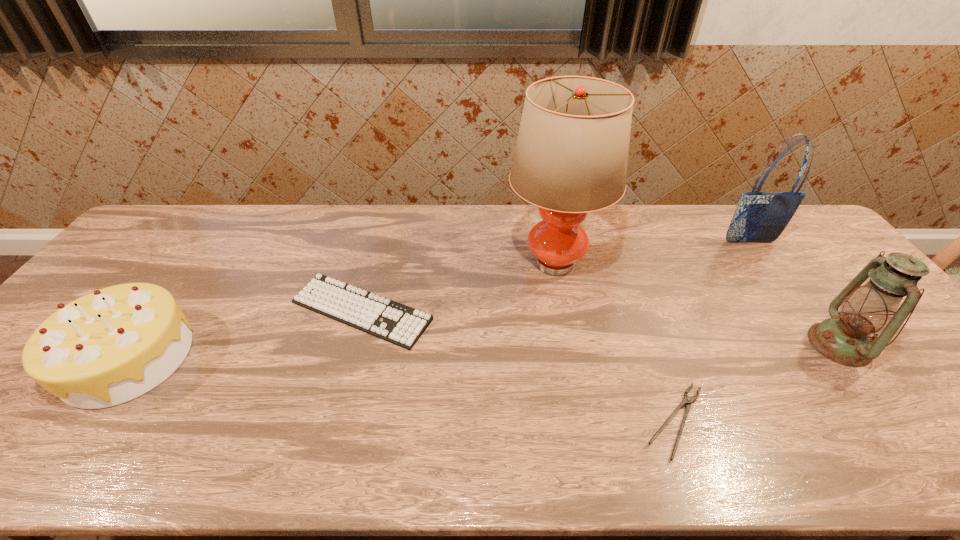
Identify the location of object located in the far right corner section of the desktop. This screenshot has width=960, height=540. (759, 217).

The image size is (960, 540). Find the location of `free location at the far edge`. free location at the far edge is located at coordinates (253, 214).

This screenshot has width=960, height=540. Find the location of `vacant space at the near edge`. vacant space at the near edge is located at coordinates (175, 449).

The height and width of the screenshot is (540, 960). What are the coordinates of `vacant area at the right edge` in the screenshot? It's located at (905, 407).

This screenshot has width=960, height=540. In the image, there is a desktop. In order to click on free space at the far left corner in this screenshot , I will do `click(204, 212)`.

In the image, there is a desktop. In order to click on blank space at the near right corner in this screenshot , I will do `click(928, 441)`.

What are the coordinates of `free point between the shopping bag and the second shortest object` in the screenshot? It's located at (556, 276).

Identify the location of free space that is in between the shortest object and the birthday cake. (402, 389).

Locate an element on the screen. Image resolution: width=960 pixels, height=540 pixels. vacant space in between the second tallest object and the fourth shortest object is located at coordinates (794, 293).

This screenshot has height=540, width=960. I want to click on vacant space that's between the shopping bag and the computer keyboard, so click(x=556, y=276).